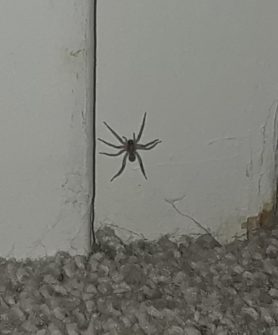
Identify the location of empty space on the left of the wall. (62, 150).